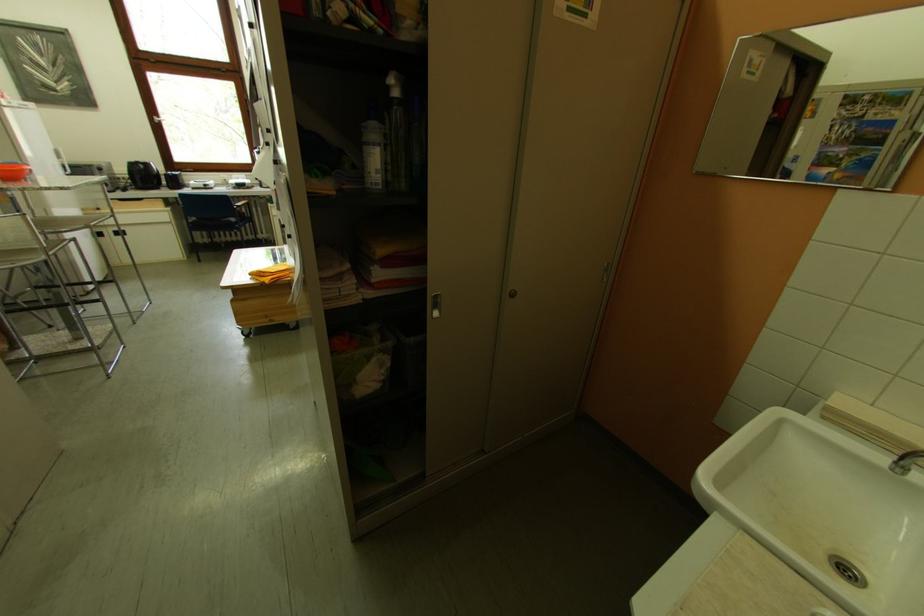
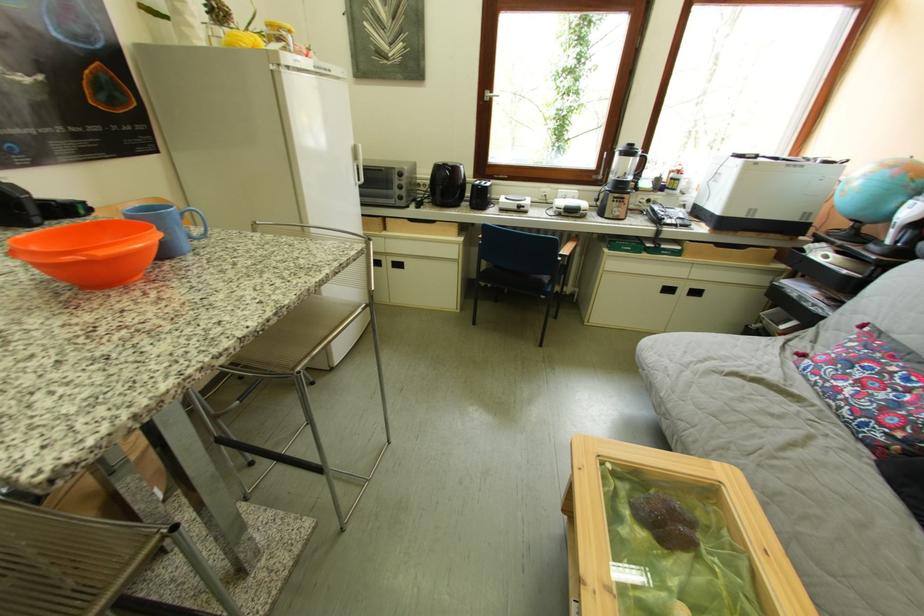
The point at (122, 236) is marked in the first image. Where is the corresponding point in the second image?

(399, 265)